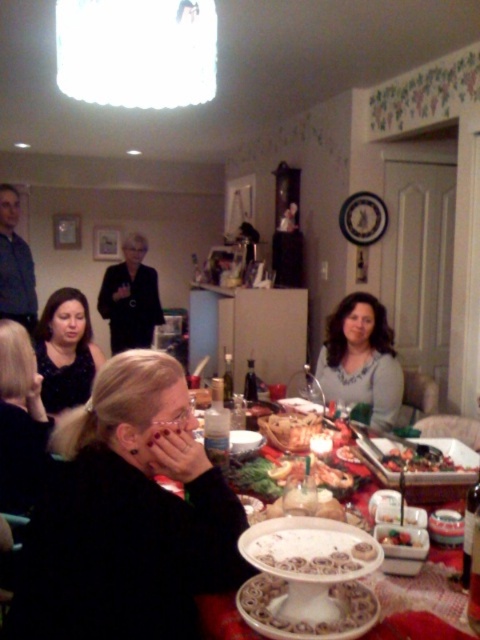
You are standing at the entrance of the dining room and see the point marked at coordinates (131, 298). What object is located at that point?

The point at coordinates (131, 298) marks the location of the black matte blazer at center.

You are a guest at the dinner and want to grab the smooth white cake at center. However, there is a matte gray sweater at center in the way. Can you reach the cake without moving the sweater?

The matte gray sweater at center is above the smooth white cake at center, so you can reach the cake without moving the sweater by going underneath it.